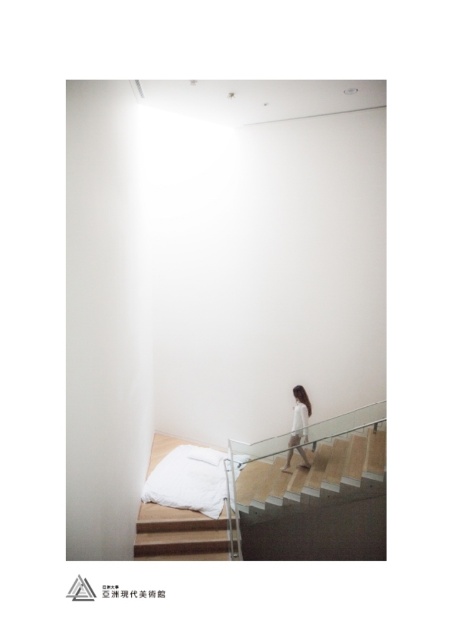
Based on the photo, between wooden staircase at center and white soft pillow at lower center, which one has less height?

Standing shorter between the two is white soft pillow at lower center.

Locate an element on the screen. Image resolution: width=452 pixels, height=640 pixels. wooden staircase at center is located at coordinates (314, 470).

What do you see at coordinates (314, 470) in the screenshot?
I see `wooden staircase at center` at bounding box center [314, 470].

Identify the location of wooden staircase at center. (314, 470).

Does wooden staircase at center have a greater height compared to white matte dress at center?

Indeed, wooden staircase at center has a greater height compared to white matte dress at center.

I want to click on wooden staircase at center, so click(x=314, y=470).

You are a GUI agent. You are given a task and a screenshot of the screen. Output one action in this format:
    pyautogui.click(x=<x>, y=<y>)
    Task: Click on the wooden staircase at center
    Image resolution: width=452 pixels, height=640 pixels.
    Given the screenshot: What is the action you would take?
    pyautogui.click(x=314, y=470)

Which of these two, wooden staircase at center or wooden stair at lower center, stands shorter?

wooden stair at lower center

Which is more to the right, wooden staircase at center or wooden stair at lower center?

wooden staircase at center

Who is more forward, (351,451) or (178,518)?

Point (178,518) is more forward.

This screenshot has width=452, height=640. In order to click on wooden staircase at center in this screenshot , I will do `click(314, 470)`.